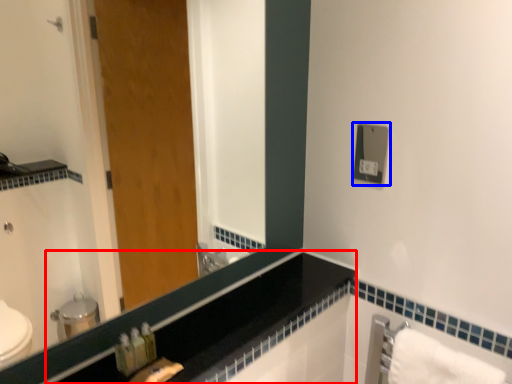
Question: Which point is closer to the camera, counter top (highlighted by a red box) or electric outlet (highlighted by a blue box)?

Choices:
 (A) counter top
 (B) electric outlet

Answer: (A)